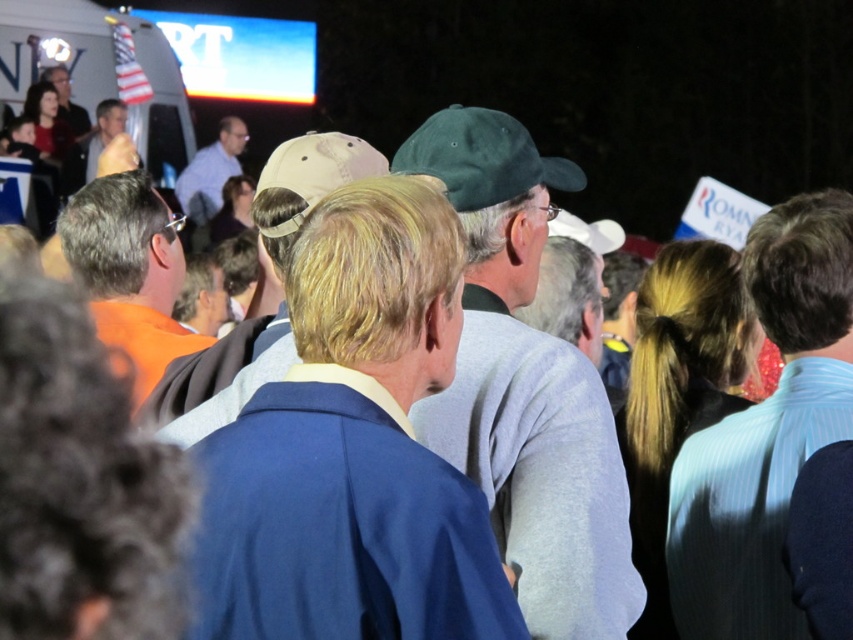
Question: Which point appears farthest from the camera in this image?

Choices:
 (A) (184, 435)
 (B) (527, 628)
 (C) (735, 465)
 (D) (68, 208)

Answer: (D)

Question: Which point is farther from the camera taking this photo?

Choices:
 (A) (325, 170)
 (B) (196, 205)
 (C) (54, 67)

Answer: (B)

Question: Is green fabric cap at center wider than matte blue shirt at center?

Choices:
 (A) no
 (B) yes

Answer: (B)

Question: Which point is farther to the camera?

Choices:
 (A) matte black jacket at upper left
 (B) light brown leather jacket at center

Answer: (A)

Question: Does green fabric cap at center appear over matte blue shirt at center?

Choices:
 (A) no
 (B) yes

Answer: (A)

Question: Does light blue striped shirt at right appear under matte blue shirt at center?

Choices:
 (A) yes
 (B) no

Answer: (A)